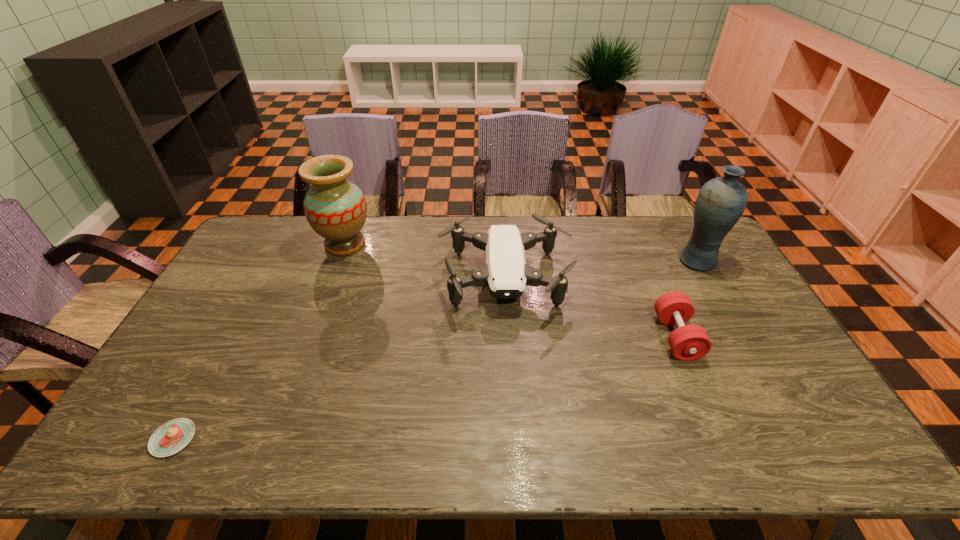
Find the location of a particular element. The width and height of the screenshot is (960, 540). the right vase is located at coordinates (720, 203).

Where is `the fourth object from right to left`? This screenshot has height=540, width=960. the fourth object from right to left is located at coordinates (336, 209).

You are a GUI agent. You are given a task and a screenshot of the screen. Output one action in this format:
    pyautogui.click(x=<x>, y=<y>)
    Task: Click on the third tallest object
    Image resolution: width=960 pixels, height=540 pixels.
    Given the screenshot: What is the action you would take?
    pyautogui.click(x=506, y=272)

Find the location of a particular element. the third object from right to left is located at coordinates (506, 272).

At what (x,y) coordinates should I click in order to perform the action: click on the fourth tallest object. Please return your answer as a coordinate pair (x, y). The height and width of the screenshot is (540, 960). Looking at the image, I should click on (688, 342).

Find the location of a particular element. dumbbell is located at coordinates (x=688, y=342).

Locate an element on the screen. This screenshot has height=540, width=960. the nearest object is located at coordinates (171, 437).

At what (x,y) coordinates should I click in order to perform the action: click on pastry. Please return your answer as a coordinate pair (x, y). Looking at the image, I should click on (171, 437).

The width and height of the screenshot is (960, 540). I want to click on free space located on the left of the rightmost object, so click(x=648, y=260).

Where is `vacant space located 0.060m on the back of the left vase`? vacant space located 0.060m on the back of the left vase is located at coordinates (354, 219).